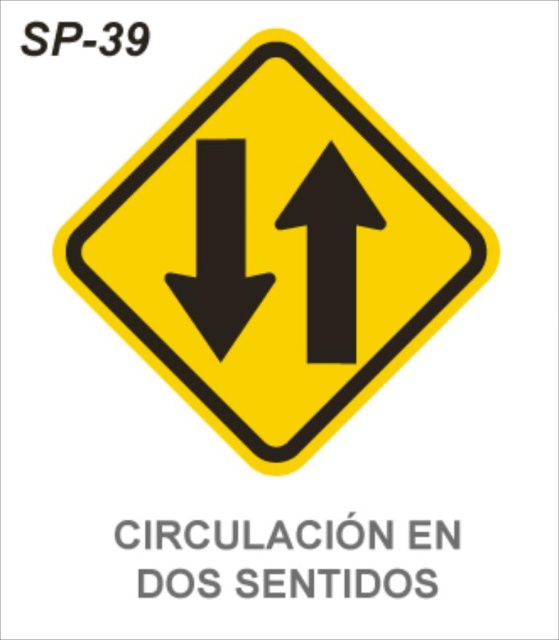
Question: Is yellow plastic diamond at center in front of black matte arrow at center?

Choices:
 (A) no
 (B) yes

Answer: (B)

Question: Can you confirm if black matte arrow at center is positioned below black solid arrow at center?

Choices:
 (A) yes
 (B) no

Answer: (B)

Question: Does black matte arrow at center have a lesser width compared to black solid arrow at center?

Choices:
 (A) no
 (B) yes

Answer: (A)

Question: Which point appears farthest from the camera in this image?

Choices:
 (A) (219, 179)
 (B) (311, 246)
 (C) (311, 300)

Answer: (C)

Question: Which point is closer to the camera?

Choices:
 (A) (334, 166)
 (B) (428, 220)

Answer: (B)

Question: Which point appears closest to the camera in this image?

Choices:
 (A) (338, 262)
 (B) (358, 234)
 (C) (243, 291)

Answer: (B)